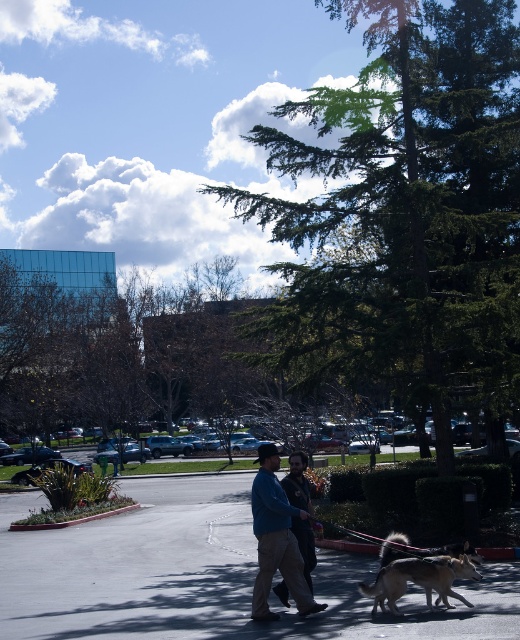
Between point (466, 616) and point (280, 560), which one is positioned behind?

Positioned behind is point (280, 560).

Is gray asphalt pavement at center shorter than blue denim jacket at center?

No, gray asphalt pavement at center is not shorter than blue denim jacket at center.

You are a GUI agent. You are given a task and a screenshot of the screen. Output one action in this format:
    pyautogui.click(x=<x>, y=<y>)
    Task: Click on the gray asphalt pavement at center
    The height and width of the screenshot is (640, 520).
    Given the screenshot: What is the action you would take?
    pyautogui.click(x=203, y=577)

At what (x,y) coordinates should I click in order to perform the action: click on gray asphalt pavement at center. Please return your answer as a coordinate pair (x, y). Looking at the image, I should click on (203, 577).

Is point (397, 212) positioned after point (334, 628)?

Yes, it is behind point (334, 628).

The width and height of the screenshot is (520, 640). What are the coordinates of `green leafy tree at center` in the screenshot? It's located at (406, 212).

Is point (336, 157) closer to viewer compared to point (459, 563)?

No, (336, 157) is further to viewer.

Between point (443, 358) and point (461, 572), which one is positioned in front?

Point (461, 572)

Is point (333, 292) positioned before point (383, 573)?

No, (333, 292) is behind (383, 573).

Find the location of `green leafy tree at center`. green leafy tree at center is located at coordinates (406, 212).